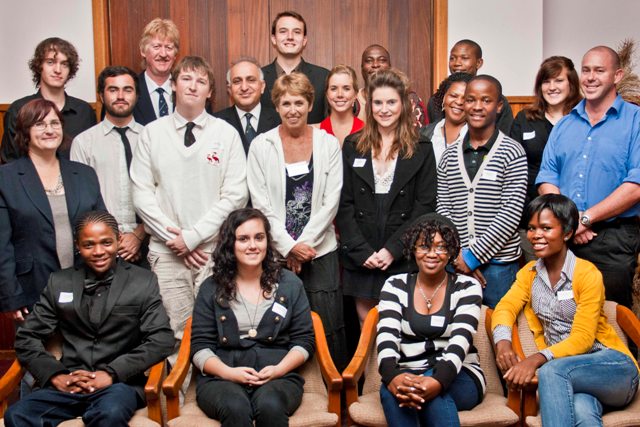
The width and height of the screenshot is (640, 427). Identify the location of chairs. (x=348, y=362), (x=326, y=404), (x=154, y=413).